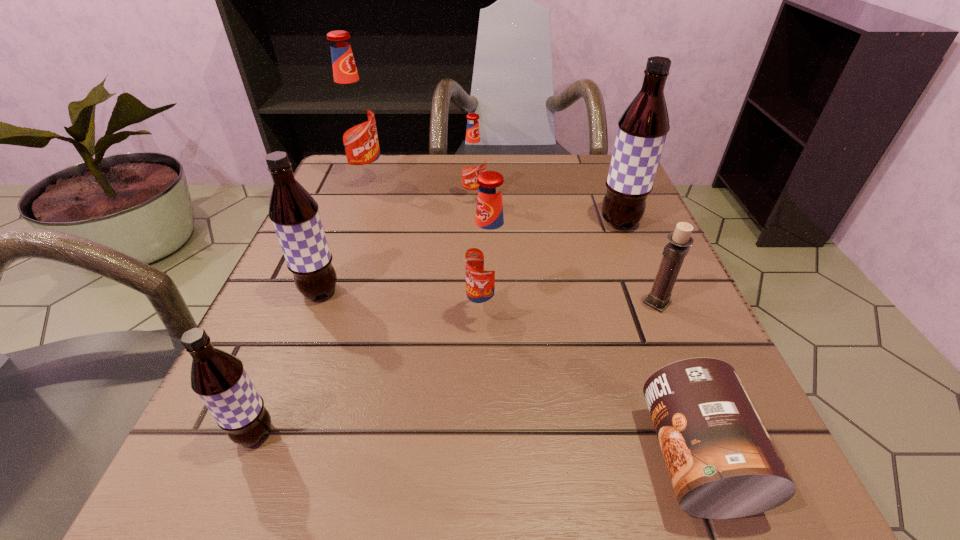
This screenshot has width=960, height=540. I want to click on the biggest red root beer, so click(x=353, y=116).

Identify the location of the leftmost red root beer. (353, 116).

This screenshot has height=540, width=960. In order to click on the third farthest root beer in this screenshot , I will do `click(642, 129)`.

The height and width of the screenshot is (540, 960). Identify the location of the third farthest object. (642, 129).

This screenshot has width=960, height=540. Identify the location of the second biggest brown root beer. (294, 213).

I want to click on the second smallest red root beer, so click(x=489, y=256).

Where is `the second farthest object`? the second farthest object is located at coordinates (473, 162).

Locate an element on the screen. the second farthest red root beer is located at coordinates (473, 162).

At what (x,y) coordinates should I click in order to perform the action: click on the nearest brown root beer. Please return your answer as a coordinate pair (x, y). Looking at the image, I should click on (219, 379).

The height and width of the screenshot is (540, 960). In order to click on the smallest brown root beer in this screenshot , I will do `click(219, 379)`.